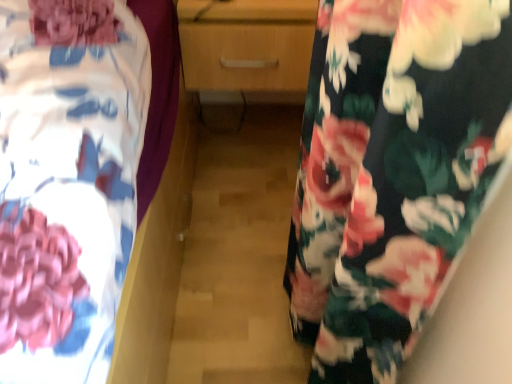
The height and width of the screenshot is (384, 512). What do you see at coordinates (248, 46) in the screenshot?
I see `wooden chest of drawers at center` at bounding box center [248, 46].

Image resolution: width=512 pixels, height=384 pixels. Identify the location of wooden chest of drawers at center. (248, 46).

Image resolution: width=512 pixels, height=384 pixels. Find the location of `wooden chest of drawers at center`. wooden chest of drawers at center is located at coordinates (248, 46).